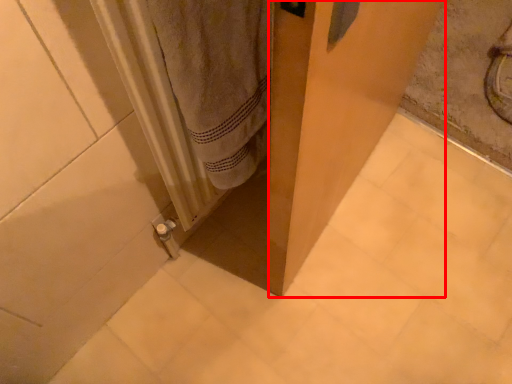
Question: From the image's perspective, considering the relative positions of screen door (annotated by the red box) and radiator in the image provided, where is screen door (annotated by the red box) located with respect to the staircase?

Choices:
 (A) above
 (B) below

Answer: (A)